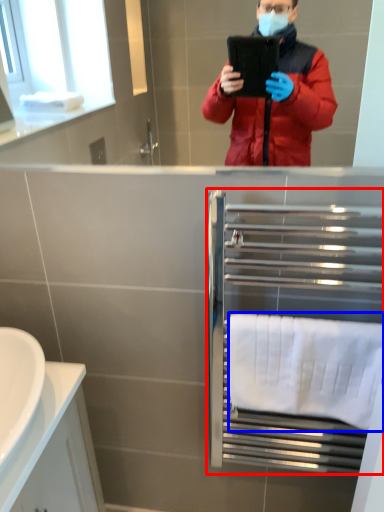
Question: Which of the following is the farthest to the observer, balustrade (highlighted by a red box) or towel/napkin (highlighted by a blue box)?

Choices:
 (A) balustrade
 (B) towel/napkin

Answer: (B)